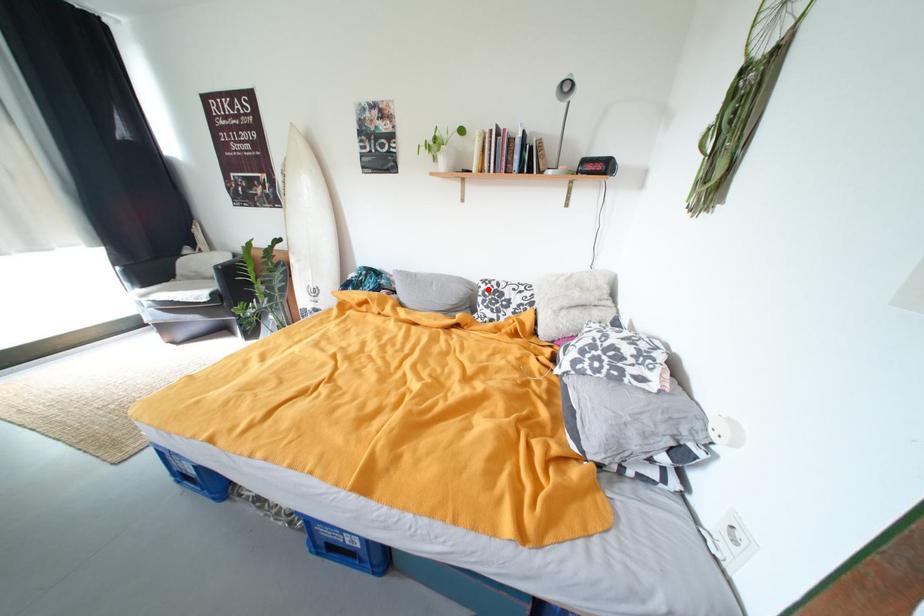
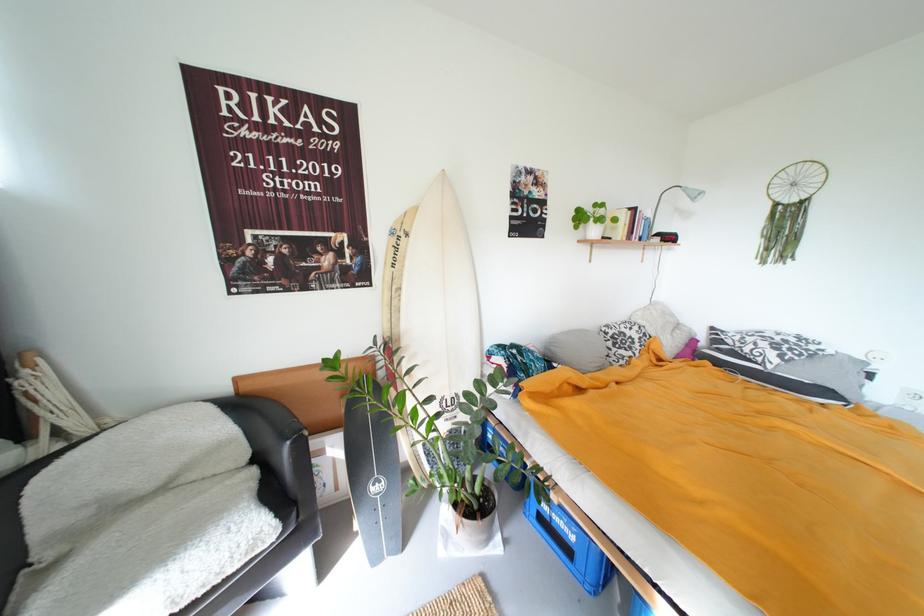
Find the pixel in the second image that matches the highlighted location in the first image.

(614, 334)